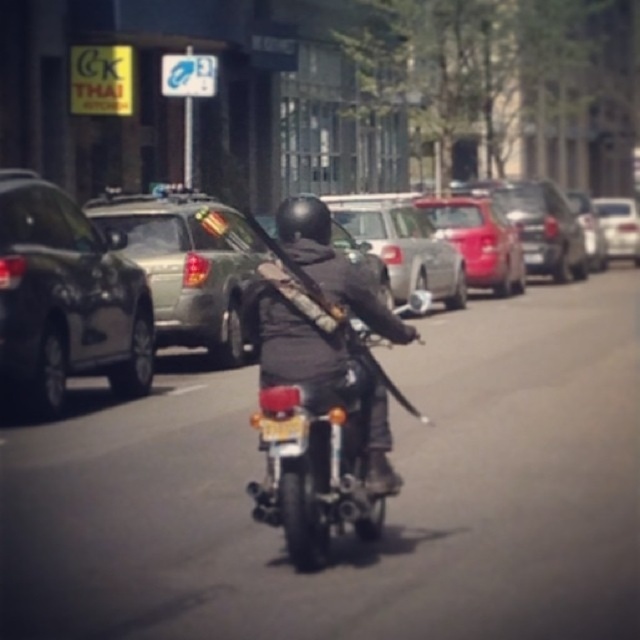
You are a GUI agent. You are given a task and a screenshot of the screen. Output one action in this format:
    pyautogui.click(x=<x>, y=<y>)
    Task: Click on the metallic green suv at center-left
    
    Given the screenshot: What is the action you would take?
    pyautogui.click(x=67, y=296)

Which is behind, point (19, 269) or point (289, 552)?

The point (19, 269) is more distant.

Locate an element on the screen. The image size is (640, 640). metallic green suv at center-left is located at coordinates (67, 296).

Between shiny black suv at left and shiny chrome motorcycle at center, which one has more height?

shiny black suv at left

You are a GUI agent. You are given a task and a screenshot of the screen. Output one action in this format:
    pyautogui.click(x=<x>, y=<y>)
    Task: Click on the shiny black suv at left
    
    Given the screenshot: What is the action you would take?
    click(x=65, y=298)

Image resolution: width=640 pixels, height=640 pixels. What do you see at coordinates (65, 298) in the screenshot? I see `shiny black suv at left` at bounding box center [65, 298].

In order to click on shiny black suv at left in this screenshot , I will do 65,298.

The width and height of the screenshot is (640, 640). In order to click on metallic green suv at center-left in this screenshot , I will do `click(67, 296)`.

Between metallic green suv at center-left and shiny black suv at left, which one appears on the right side from the viewer's perspective?

shiny black suv at left

At what (x,y) coordinates should I click in order to perform the action: click on metallic green suv at center-left. Please return your answer as a coordinate pair (x, y). Looking at the image, I should click on (67, 296).

Locate an element on the screen. The image size is (640, 640). metallic green suv at center-left is located at coordinates (67, 296).